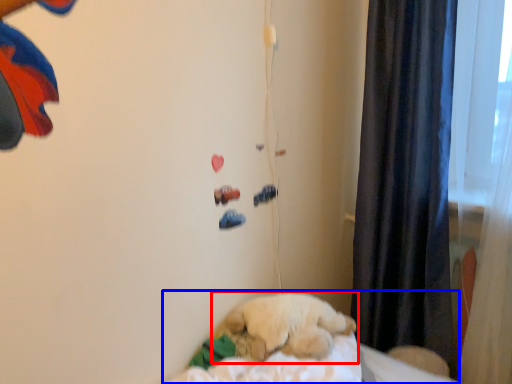
Question: Which object appears farthest to the camera in this image, dog (highlighted by a red box) or bed (highlighted by a blue box)?

Choices:
 (A) dog
 (B) bed

Answer: (A)